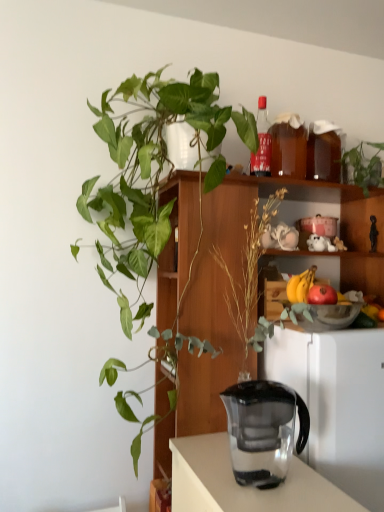
Question: Considering the relative sizes of green leafy plant at upper right, which ranks as the 1th houseplant in right-to-left order, and transparent plastic jug at center in the image provided, is green leafy plant at upper right, which ranks as the 1th houseplant in right-to-left order, wider than transparent plastic jug at center?

Choices:
 (A) yes
 (B) no

Answer: (A)

Question: Considering the relative sizes of green leafy plant at upper right, which ranks as the 2th houseplant in left-to-right order, and transparent plastic jug at center in the image provided, is green leafy plant at upper right, which ranks as the 2th houseplant in left-to-right order, bigger than transparent plastic jug at center?

Choices:
 (A) yes
 (B) no

Answer: (A)

Question: Is green leafy plant at upper right, which ranks as the 1th houseplant in right-to-left order, next to transparent plastic jug at center and touching it?

Choices:
 (A) no
 (B) yes

Answer: (A)

Question: Is green leafy plant at upper right, which ranks as the 2th houseplant in left-to-right order, turned away from transparent plastic jug at center?

Choices:
 (A) yes
 (B) no

Answer: (B)

Question: From a real-world perspective, is green leafy plant at upper right, which ranks as the 1th houseplant in right-to-left order, on transparent plastic jug at center?

Choices:
 (A) yes
 (B) no

Answer: (A)

Question: Choose the correct answer: Is transparent plastic jug at center inside green leafy plant at left, which is counted as the second houseplant, starting from the right, or outside it?

Choices:
 (A) outside
 (B) inside

Answer: (A)

Question: From the image's perspective, relative to green leafy plant at left, which is the 1th houseplant in left-to-right order, is transparent plastic jug at center above or below?

Choices:
 (A) above
 (B) below

Answer: (B)

Question: Based on their positions, is transparent plastic jug at center located to the left or right of green leafy plant at left, which is the 1th houseplant in left-to-right order?

Choices:
 (A) left
 (B) right

Answer: (B)

Question: Relative to green leafy plant at left, which is counted as the second houseplant, starting from the right, is transparent plastic jug at center in front or behind?

Choices:
 (A) behind
 (B) front

Answer: (B)

Question: Relative to transparent plastic pitcher at lower center, is green leafy plant at left, which is counted as the second houseplant, starting from the right, in front or behind?

Choices:
 (A) behind
 (B) front

Answer: (B)

Question: Is green leafy plant at left, which is the 1th houseplant in left-to-right order, inside the boundaries of transparent plastic pitcher at lower center, or outside?

Choices:
 (A) outside
 (B) inside

Answer: (A)

Question: Based on their positions, is green leafy plant at left, which is counted as the second houseplant, starting from the right, located to the left or right of transparent plastic pitcher at lower center?

Choices:
 (A) right
 (B) left

Answer: (B)

Question: Is point (84, 197) closer or farther from the camera than point (306, 386)?

Choices:
 (A) closer
 (B) farther

Answer: (B)

Question: Considering their positions, is translucent glass bowl at upper right located in front of or behind yellow matte bananas at center-right?

Choices:
 (A) behind
 (B) front

Answer: (B)

Question: In terms of size, does translucent glass bowl at upper right appear bigger or smaller than yellow matte bananas at center-right?

Choices:
 (A) small
 (B) big

Answer: (B)